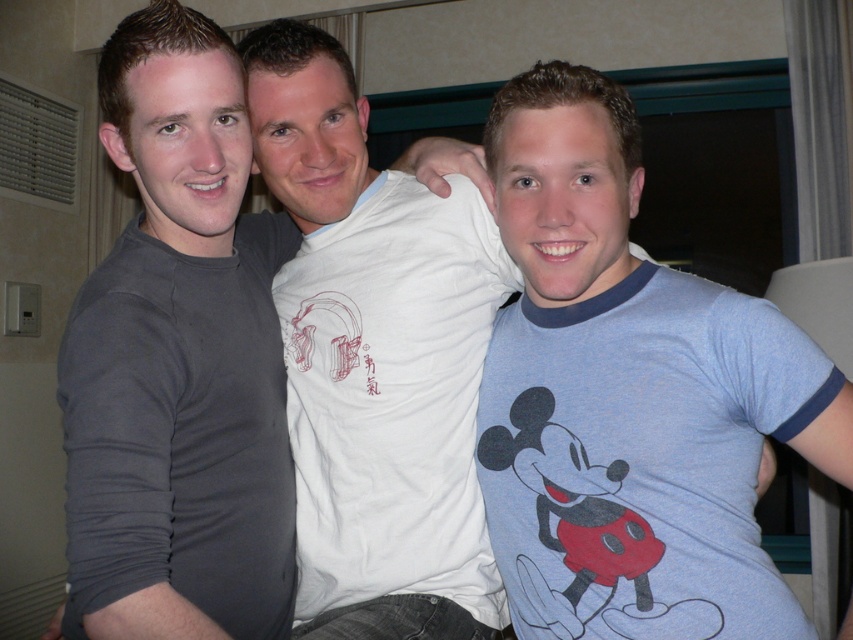
Question: Which of the following is the farthest from the observer?

Choices:
 (A) (345, 570)
 (B) (173, 195)
 (C) (495, 432)

Answer: (A)

Question: Can you confirm if blue heathered t-shirt at center is smaller than white cotton t-shirt at center?

Choices:
 (A) no
 (B) yes

Answer: (B)

Question: Where is blue heathered t-shirt at center located in relation to dark gray long-sleeve shirt at left in the image?

Choices:
 (A) left
 (B) right

Answer: (B)

Question: Which point is farther from the camera taking this photo?

Choices:
 (A) (474, 365)
 (B) (584, 168)

Answer: (A)

Question: Does blue heathered t-shirt at center have a lesser width compared to white cotton t-shirt at center?

Choices:
 (A) yes
 (B) no

Answer: (B)

Question: Which point appears closest to the camera in this image?

Choices:
 (A) (674, 460)
 (B) (158, 614)
 (C) (306, 243)

Answer: (B)